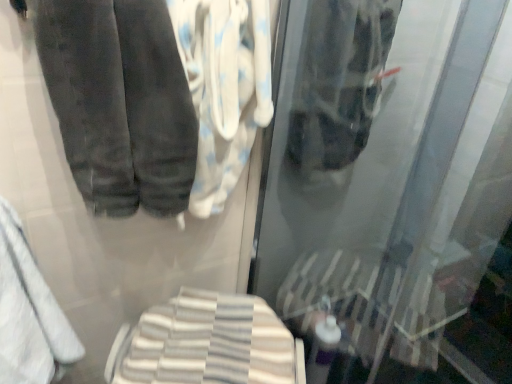
Question: Is the surface of transparent glass shower door at center in direct contact with white soft towel at lower left?

Choices:
 (A) no
 (B) yes

Answer: (A)

Question: Does transparent glass shower door at center come behind white soft towel at lower left?

Choices:
 (A) yes
 (B) no

Answer: (B)

Question: From the image's perspective, is transparent glass shower door at center over white soft towel at lower left?

Choices:
 (A) yes
 (B) no

Answer: (A)

Question: Considering the relative sizes of transparent glass shower door at center and white soft towel at lower left in the image provided, is transparent glass shower door at center wider than white soft towel at lower left?

Choices:
 (A) yes
 (B) no

Answer: (B)

Question: Does transparent glass shower door at center have a lesser height compared to white soft towel at lower left?

Choices:
 (A) no
 (B) yes

Answer: (A)

Question: From a real-world perspective, is transparent glass shower door at center beneath white soft towel at lower left?

Choices:
 (A) yes
 (B) no

Answer: (B)

Question: Can you confirm if dark gray velvety trousers at upper left is smaller than transparent glass shower door at center?

Choices:
 (A) no
 (B) yes

Answer: (B)

Question: From the image's perspective, is dark gray velvety trousers at upper left below transparent glass shower door at center?

Choices:
 (A) yes
 (B) no

Answer: (B)

Question: From the image's perspective, would you say dark gray velvety trousers at upper left is positioned over transparent glass shower door at center?

Choices:
 (A) no
 (B) yes

Answer: (B)

Question: Would you say dark gray velvety trousers at upper left is outside transparent glass shower door at center?

Choices:
 (A) no
 (B) yes

Answer: (B)

Question: Can you confirm if dark gray velvety trousers at upper left is positioned to the right of transparent glass shower door at center?

Choices:
 (A) no
 (B) yes

Answer: (A)

Question: Is dark gray velvety trousers at upper left closer to the viewer compared to transparent glass shower door at center?

Choices:
 (A) yes
 (B) no

Answer: (B)

Question: Is the depth of white cotton towel at center, acting as the first cloth starting from the top, greater than that of white striped towel at lower center, the 2th cloth from the top?

Choices:
 (A) no
 (B) yes

Answer: (A)